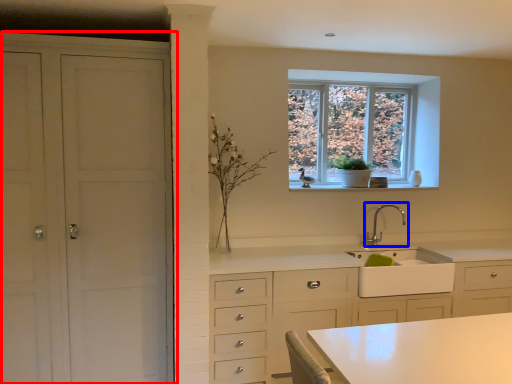
Question: Which of the following is the farthest to the observer, cupboard (highlighted by a red box) or tap (highlighted by a blue box)?

Choices:
 (A) cupboard
 (B) tap

Answer: (B)